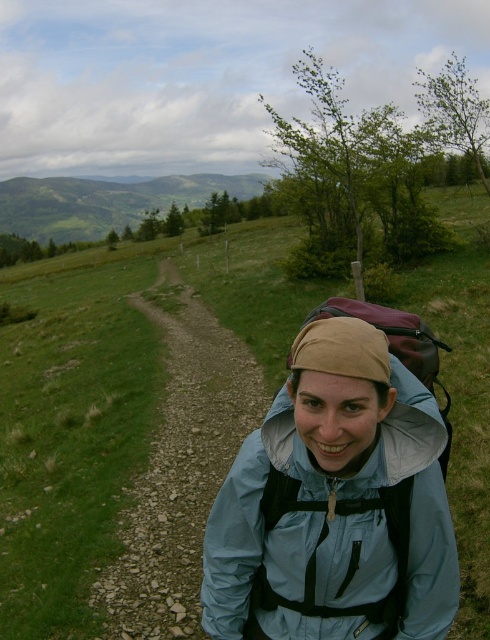
Question: Is light blue waterproof jacket at center further to the viewer compared to dirt/gravel path at center?

Choices:
 (A) no
 (B) yes

Answer: (A)

Question: Which object is the closest to the dark blue fabric backpack at center?

Choices:
 (A) dirt/gravel path at center
 (B) light blue waterproof jacket at center
 (C) green grassy at center
 (D) green grassy hillside at upper left

Answer: (B)

Question: Which of these objects is positioned farthest from the green grassy hillside at upper left?

Choices:
 (A) dark blue fabric backpack at center
 (B) light blue waterproof jacket at center
 (C) dirt/gravel path at center

Answer: (A)

Question: Does green grassy at center have a smaller size compared to light blue waterproof jacket at center?

Choices:
 (A) no
 (B) yes

Answer: (A)

Question: Does dirt/gravel path at center appear under dark blue fabric backpack at center?

Choices:
 (A) yes
 (B) no

Answer: (A)

Question: Which of these objects is positioned farthest from the dark blue fabric backpack at center?

Choices:
 (A) light blue waterproof jacket at center
 (B) green grassy at center
 (C) dirt/gravel path at center

Answer: (B)